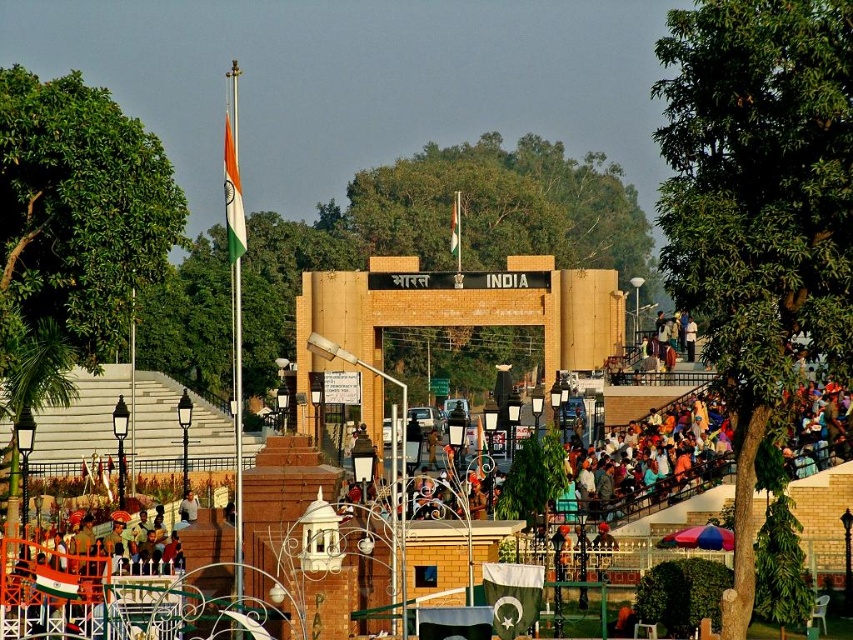
Which is in front, point (236, 248) or point (457, 214)?

Positioned in front is point (236, 248).

Can you confirm if tri-color fabric flag at upper center is smaller than tri-color fabric flag at center?

No, tri-color fabric flag at upper center is not smaller than tri-color fabric flag at center.

Which is in front, point (234, 218) or point (459, 212)?

Point (234, 218) is more forward.

You are a GUI agent. You are given a task and a screenshot of the screen. Output one action in this format:
    pyautogui.click(x=<x>, y=<y>)
    Task: Click on the tri-color fabric flag at upper center
    
    Given the screenshot: What is the action you would take?
    pyautogui.click(x=231, y=196)